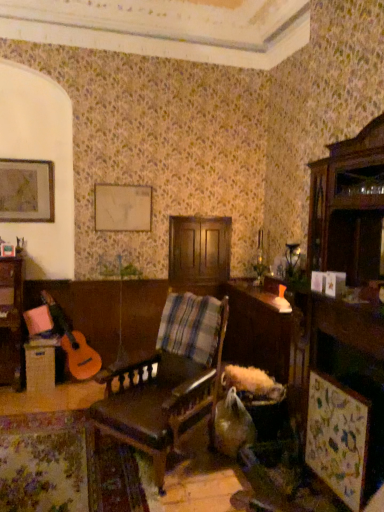
Locate an element on the screen. The width and height of the screenshot is (384, 512). vacant area that lies in front of wooden table at lower left, positioned as the 1th table in left-to-right order is located at coordinates (38, 395).